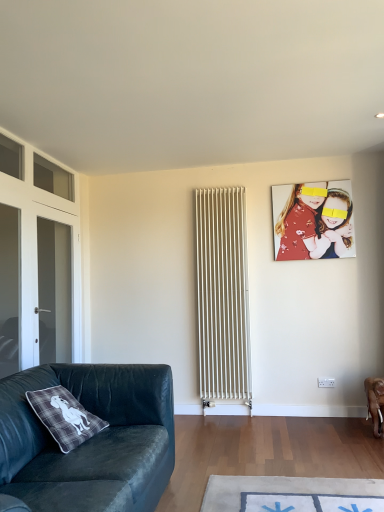
Where is `free location to the left of white metal radiator at center`? This screenshot has height=512, width=384. free location to the left of white metal radiator at center is located at coordinates (193, 422).